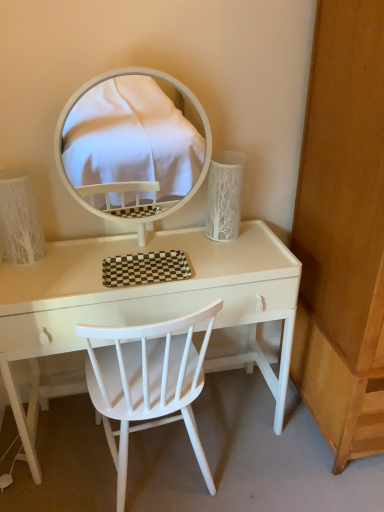
Where is `free spot below white glossy mirror at upper center (from a real-world perspective)`? The height and width of the screenshot is (512, 384). free spot below white glossy mirror at upper center (from a real-world perspective) is located at coordinates (153, 245).